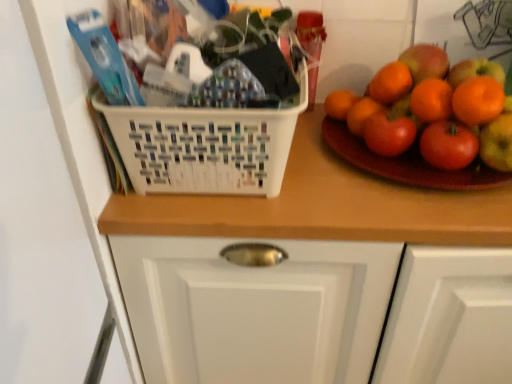
Question: From a real-world perspective, is glossy wooden plate at right on top of white plastic basket at center?

Choices:
 (A) no
 (B) yes

Answer: (B)

Question: Is white plastic basket at center a part of glossy wooden plate at right?

Choices:
 (A) no
 (B) yes

Answer: (A)

Question: From a real-world perspective, is glossy wooden plate at right positioned under white plastic basket at center based on gravity?

Choices:
 (A) no
 (B) yes

Answer: (A)

Question: From the image's perspective, does glossy wooden plate at right appear lower than white plastic basket at center?

Choices:
 (A) yes
 (B) no

Answer: (A)

Question: Can you confirm if glossy wooden plate at right is bigger than white plastic basket at center?

Choices:
 (A) no
 (B) yes

Answer: (A)

Question: Considering the relative positions of glossy wooden plate at right and white plastic basket at center in the image provided, is glossy wooden plate at right to the left of white plastic basket at center from the viewer's perspective?

Choices:
 (A) yes
 (B) no

Answer: (B)

Question: Does white plastic basket at center have a lesser height compared to wooden counter at center?

Choices:
 (A) yes
 (B) no

Answer: (A)

Question: From the image's perspective, is white plastic basket at center over wooden counter at center?

Choices:
 (A) yes
 (B) no

Answer: (A)

Question: From a real-world perspective, is white plastic basket at center on wooden counter at center?

Choices:
 (A) yes
 (B) no

Answer: (A)

Question: Is the depth of white plastic basket at center less than that of wooden counter at center?

Choices:
 (A) yes
 (B) no

Answer: (A)

Question: Is white plastic basket at center outside of wooden counter at center?

Choices:
 (A) yes
 (B) no

Answer: (A)

Question: Could you tell me if white plastic basket at center is facing wooden counter at center?

Choices:
 (A) yes
 (B) no

Answer: (B)

Question: Does glossy wooden plate at right lie behind wooden counter at center?

Choices:
 (A) yes
 (B) no

Answer: (A)